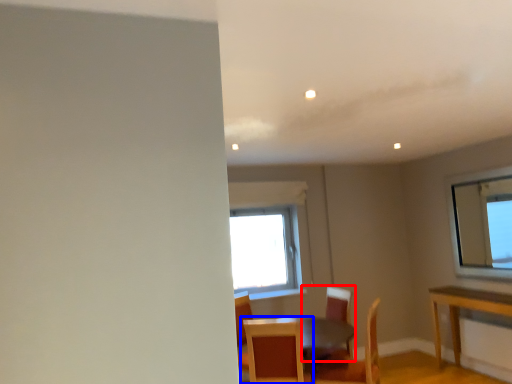
Question: Which object appears closest to the camera in this image, chair (highlighted by a red box) or chair (highlighted by a blue box)?

Choices:
 (A) chair
 (B) chair

Answer: (B)